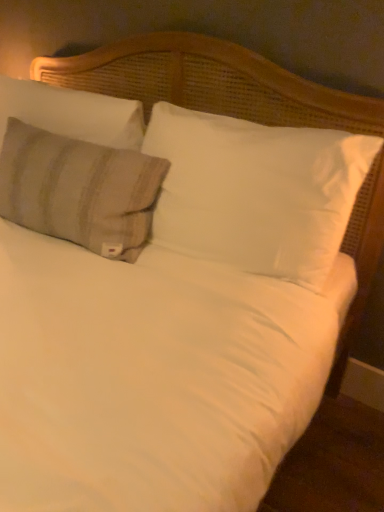
Question: Would you say white soft pillow at center, the third pillow when ordered from left to right, is a long distance from beige striped fabric pillow at upper left, acting as the 2th pillow starting from the left?

Choices:
 (A) no
 (B) yes

Answer: (A)

Question: Is white soft pillow at center, the third pillow when ordered from left to right, placed right next to beige striped fabric pillow at upper left, acting as the 2th pillow starting from the left?

Choices:
 (A) yes
 (B) no

Answer: (B)

Question: Can you confirm if white soft pillow at center, which is the first pillow in right-to-left order, is smaller than beige striped fabric pillow at upper left, acting as the 2th pillow starting from the left?

Choices:
 (A) no
 (B) yes

Answer: (A)

Question: Can you confirm if white soft pillow at center, the third pillow when ordered from left to right, is bigger than beige striped fabric pillow at upper left, acting as the 2th pillow starting from the left?

Choices:
 (A) no
 (B) yes

Answer: (B)

Question: From the image's perspective, is white soft pillow at center, which is the first pillow in right-to-left order, on top of beige striped fabric pillow at upper left, acting as the 2th pillow starting from the left?

Choices:
 (A) yes
 (B) no

Answer: (B)

Question: From the image's perspective, is white soft pillow at center, which is the first pillow in right-to-left order, beneath beige striped fabric pillow at upper left, acting as the 2th pillow starting from the left?

Choices:
 (A) yes
 (B) no

Answer: (A)

Question: From the image's perspective, is beige striped pillow at left, which is the 3th pillow in right-to-left order, beneath beige striped fabric pillow at upper left, which is counted as the 2th pillow, starting from the right?

Choices:
 (A) no
 (B) yes

Answer: (A)

Question: Is beige striped pillow at left, which is the 3th pillow in right-to-left order, shorter than beige striped fabric pillow at upper left, which is counted as the 2th pillow, starting from the right?

Choices:
 (A) yes
 (B) no

Answer: (A)

Question: Is beige striped pillow at left, which ranks as the 1th pillow in left-to-right order, next to beige striped fabric pillow at upper left, acting as the 2th pillow starting from the left, and touching it?

Choices:
 (A) no
 (B) yes

Answer: (A)

Question: Does beige striped pillow at left, which ranks as the 1th pillow in left-to-right order, have a larger size compared to beige striped fabric pillow at upper left, acting as the 2th pillow starting from the left?

Choices:
 (A) yes
 (B) no

Answer: (B)

Question: Is beige striped pillow at left, which ranks as the 1th pillow in left-to-right order, oriented towards beige striped fabric pillow at upper left, which is counted as the 2th pillow, starting from the right?

Choices:
 (A) no
 (B) yes

Answer: (B)

Question: Is beige striped pillow at left, which ranks as the 1th pillow in left-to-right order, not close to beige striped fabric pillow at upper left, which is counted as the 2th pillow, starting from the right?

Choices:
 (A) no
 (B) yes

Answer: (A)

Question: From a real-world perspective, is white soft pillow at center, which is the first pillow in right-to-left order, on top of beige striped pillow at left, which ranks as the 1th pillow in left-to-right order?

Choices:
 (A) yes
 (B) no

Answer: (B)